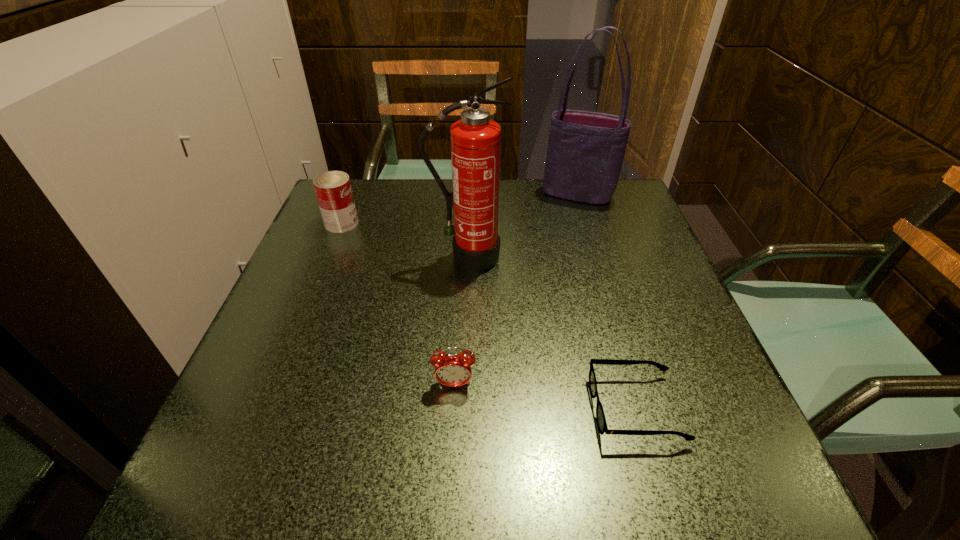
This screenshot has height=540, width=960. I want to click on vacant space that is in between the fire extinguisher and the second shortest object, so click(461, 320).

You are a GUI agent. You are given a task and a screenshot of the screen. Output one action in this format:
    pyautogui.click(x=<x>, y=<y>)
    Task: Click on the free spot between the farthest object and the alarm clock
    The height and width of the screenshot is (540, 960).
    Given the screenshot: What is the action you would take?
    pyautogui.click(x=516, y=289)

This screenshot has width=960, height=540. What are the coordinates of `vacant area that lies between the third farthest object and the shortest object` in the screenshot? It's located at (551, 333).

What are the coordinates of `unoccupied area between the third farthest object and the spectacles` in the screenshot? It's located at (551, 333).

You are a GUI agent. You are given a task and a screenshot of the screen. Output one action in this format:
    pyautogui.click(x=<x>, y=<y>)
    Task: Click on the free space between the shortest object and the alarm clock
    
    Given the screenshot: What is the action you would take?
    pyautogui.click(x=545, y=396)

At what (x,y) coordinates should I click in order to perform the action: click on free space between the third nearest object and the farthest object. Please return your answer as a coordinate pair (x, y). Looking at the image, I should click on (522, 226).

Image resolution: width=960 pixels, height=540 pixels. In order to click on vacant space that's between the farthest object and the fourth tallest object in this screenshot , I will do `click(516, 289)`.

In order to click on free space between the shortest object and the farthest object in this screenshot , I will do `click(607, 301)`.

Identify which object is located as the second nearest to the farthest object. Please provide its 2D coordinates. Your answer should be formatted as a tuple, i.e. [(x, y)], where the tuple contains the x and y coordinates of a point satisfying the conditions above.

[(333, 190)]

Find the location of a particular element. The height and width of the screenshot is (540, 960). object that is the third closest to the shortest object is located at coordinates pyautogui.click(x=585, y=153).